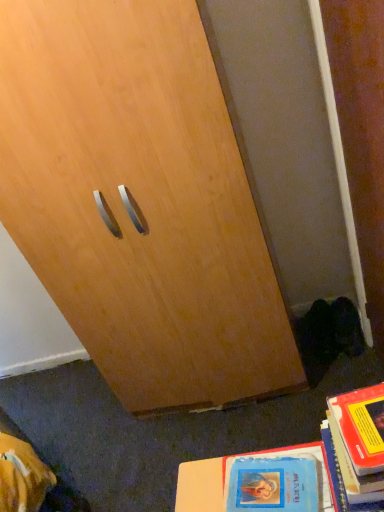
Question: Is blue matte book at lower right, the first book positioned from the left, inside the boundaries of hardcover book at lower right, the 1th book positioned from the right, or outside?

Choices:
 (A) outside
 (B) inside

Answer: (A)

Question: Looking at the image, does blue matte book at lower right, the first book positioned from the left, seem bigger or smaller compared to hardcover book at lower right, which is the 2th book from left to right?

Choices:
 (A) big
 (B) small

Answer: (B)

Question: Considering the positions of blue matte book at lower right, which is the second book from right to left, and hardcover book at lower right, the 1th book positioned from the right, in the image, is blue matte book at lower right, which is the second book from right to left, taller or shorter than hardcover book at lower right, the 1th book positioned from the right,?

Choices:
 (A) short
 (B) tall

Answer: (A)

Question: Considering the relative positions of hardcover book at lower right, the 1th book positioned from the right, and blue matte book at lower right, which is the second book from right to left, in the image provided, is hardcover book at lower right, the 1th book positioned from the right, to the left or to the right of blue matte book at lower right, which is the second book from right to left,?

Choices:
 (A) right
 (B) left

Answer: (A)

Question: Is hardcover book at lower right, which is the 2th book from left to right, bigger or smaller than blue matte book at lower right, the first book positioned from the left?

Choices:
 (A) small
 (B) big

Answer: (B)

Question: Does point (349, 454) appear closer or farther from the camera than point (182, 478)?

Choices:
 (A) closer
 (B) farther

Answer: (A)

Question: From a real-world perspective, is hardcover book at lower right, the 1th book positioned from the right, above or below blue matte book at lower right, which is the second book from right to left?

Choices:
 (A) below
 (B) above

Answer: (B)